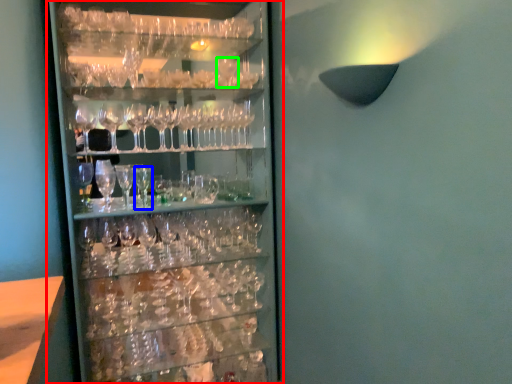
Question: Estimate the real-world distances between objects in this image. Which object is closer to shelf (highlighted by a red box), beer glass (highlighted by a blue box) or wine glass (highlighted by a green box)?

Choices:
 (A) beer glass
 (B) wine glass

Answer: (A)